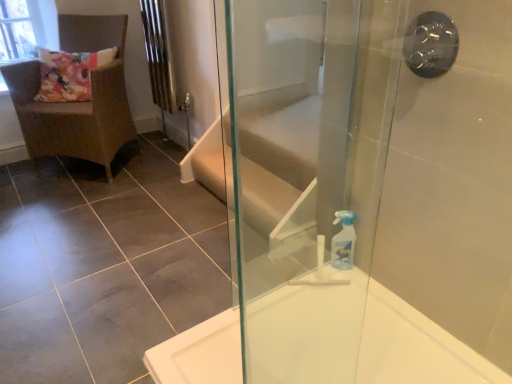
Locate an element on the screen. brown woven chair at upper left is located at coordinates (77, 102).

This screenshot has width=512, height=384. Find the location of `transparent glass screen door at right`. transparent glass screen door at right is located at coordinates (273, 137).

Measure the distance between black metallic shower handle at upper right and camera.

black metallic shower handle at upper right and camera are 1.17 meters apart from each other.

What are the coordinates of `black metallic shower handle at upper right` in the screenshot? It's located at (430, 44).

Image resolution: width=512 pixels, height=384 pixels. Identify the location of transparent glass window screen at upper left. point(29,25).

What is the approximate height of white glossy bathtub at lower right?

white glossy bathtub at lower right is 2.74 inches in height.

What is the approximate width of white glossy bathtub at lower right?

white glossy bathtub at lower right is 90.80 centimeters wide.

Identify the location of brown woven chair at upper left. (77, 102).

Looking at this image, is transparent glass window screen at upper left wider than black metallic shower handle at upper right?

Indeed, transparent glass window screen at upper left has a greater width compared to black metallic shower handle at upper right.

Does transparent glass window screen at upper left come behind black metallic shower handle at upper right?

Yes, transparent glass window screen at upper left is further from the viewer.

Between transparent glass window screen at upper left and black metallic shower handle at upper right, which one appears on the left side from the viewer's perspective?

transparent glass window screen at upper left.

From a real-world perspective, does transparent glass window screen at upper left sit lower than black metallic shower handle at upper right?

Yes.

Between brown woven chair at upper left and white glossy bathtub at lower right, which one has less height?

Standing shorter between the two is white glossy bathtub at lower right.

Visually, is brown woven chair at upper left positioned to the left or to the right of white glossy bathtub at lower right?

brown woven chair at upper left is positioned on white glossy bathtub at lower right's left side.

From a real-world perspective, does brown woven chair at upper left sit lower than white glossy bathtub at lower right?

No, from a real-world perspective, brown woven chair at upper left is not below white glossy bathtub at lower right.

Can you confirm if white glossy bathtub at lower right is taller than black metallic shower handle at upper right?

In fact, white glossy bathtub at lower right may be shorter than black metallic shower handle at upper right.

From a real-world perspective, is white glossy bathtub at lower right physically above black metallic shower handle at upper right?

No, from a real-world perspective, white glossy bathtub at lower right is not above black metallic shower handle at upper right.

Find the location of a particular element. bathtub lying in front of the black metallic shower handle at upper right is located at coordinates (415, 347).

Which is behind, point (392, 360) or point (455, 48)?

Positioned behind is point (392, 360).

Which point is more forward, (44, 21) or (81, 122)?

The point (81, 122) is more forward.

Between transparent glass window screen at upper left and brown woven chair at upper left, which one has smaller width?

Thinner between the two is transparent glass window screen at upper left.

In terms of size, does transparent glass window screen at upper left appear bigger or smaller than brown woven chair at upper left?

Clearly, transparent glass window screen at upper left is smaller in size than brown woven chair at upper left.

How many degrees apart are the facing directions of transparent glass window screen at upper left and brown woven chair at upper left?

46.4 degrees.

Can you confirm if black metallic shower handle at upper right is positioned to the left of transparent glass window screen at upper left?

No.

This screenshot has height=384, width=512. In order to click on shower above the transparent glass window screen at upper left (from a real-world perspective) in this screenshot , I will do `click(430, 44)`.

From a real-world perspective, is black metallic shower handle at upper right beneath transparent glass window screen at upper left?

No, from a real-world perspective, black metallic shower handle at upper right is not beneath transparent glass window screen at upper left.

How distant is black metallic shower handle at upper right from transparent glass window screen at upper left?

8.66 feet.

How far apart are transparent plastic spray bottle at right and white glossy bathtub at lower right?

transparent plastic spray bottle at right and white glossy bathtub at lower right are 10.47 inches apart from each other.

Is point (354, 233) positioned in front of point (446, 380)?

No.

In the scene shown: Would you say transparent plastic spray bottle at right is inside or outside white glossy bathtub at lower right?

transparent plastic spray bottle at right is spatially situated outside white glossy bathtub at lower right.

Is transparent plastic spray bottle at right touching white glossy bathtub at lower right?

They are not placed beside each other.

From the image's perspective, between transparent glass screen door at right and white glossy bathtub at lower right, which one is located above?

From the image's view, transparent glass screen door at right is above.

I want to click on screen door that appears on the left of white glossy bathtub at lower right, so click(x=273, y=137).

Is transparent glass screen door at right bigger or smaller than white glossy bathtub at lower right?

Considering their sizes, transparent glass screen door at right takes up less space than white glossy bathtub at lower right.

Is transparent glass screen door at right aimed at white glossy bathtub at lower right?

Yes, transparent glass screen door at right is aimed at white glossy bathtub at lower right.

Locate an element on the screen. Image resolution: width=512 pixels, height=384 pixels. window screen behind the black metallic shower handle at upper right is located at coordinates (29, 25).

Locate an element on the screen. This screenshot has height=384, width=512. bathtub on the right of brown woven chair at upper left is located at coordinates (415, 347).

From the picture: When comparing their distances from white glossy bathtub at lower right, does black metallic shower handle at upper right or brown woven chair at upper left seem further?

Among the two, brown woven chair at upper left is located further to white glossy bathtub at lower right.

Estimate the real-world distances between objects in this image. Which object is further from transparent plastic spray bottle at right, transparent glass window screen at upper left or transparent glass screen door at right?

transparent glass window screen at upper left.

Based on their spatial positions, is transparent plastic spray bottle at right or transparent glass screen door at right closer to black metallic shower handle at upper right?

Based on the image, transparent plastic spray bottle at right appears to be nearer to black metallic shower handle at upper right.

Based on their spatial positions, is transparent glass screen door at right or brown woven chair at upper left closer to white glossy bathtub at lower right?

transparent glass screen door at right is positioned closer to the anchor white glossy bathtub at lower right.

Looking at this image, from the image, which object appears to be nearer to brown woven chair at upper left, black metallic shower handle at upper right or white glossy bathtub at lower right?

white glossy bathtub at lower right is closer to brown woven chair at upper left.

Considering their positions, is transparent glass screen door at right positioned closer to black metallic shower handle at upper right than brown woven chair at upper left?

The object closer to black metallic shower handle at upper right is transparent glass screen door at right.

When comparing their distances from transparent plastic spray bottle at right, does brown woven chair at upper left or transparent glass screen door at right seem closer?

Based on the image, transparent glass screen door at right appears to be nearer to transparent plastic spray bottle at right.

Considering their positions, is brown woven chair at upper left positioned further to transparent plastic spray bottle at right than black metallic shower handle at upper right?

brown woven chair at upper left is further to transparent plastic spray bottle at right.

Where is `chair between transparent glass window screen at upper left and transparent plastic spray bottle at right from left to right`? Image resolution: width=512 pixels, height=384 pixels. chair between transparent glass window screen at upper left and transparent plastic spray bottle at right from left to right is located at coordinates (77, 102).

Image resolution: width=512 pixels, height=384 pixels. In order to click on screen door located between white glossy bathtub at lower right and transparent plastic spray bottle at right in the depth direction in this screenshot , I will do `click(273, 137)`.

Where is `screen door between transparent glass window screen at upper left and transparent plastic spray bottle at right`? This screenshot has width=512, height=384. screen door between transparent glass window screen at upper left and transparent plastic spray bottle at right is located at coordinates (273, 137).

This screenshot has width=512, height=384. In order to click on screen door between brown woven chair at upper left and white glossy bathtub at lower right in this screenshot , I will do `click(273, 137)`.